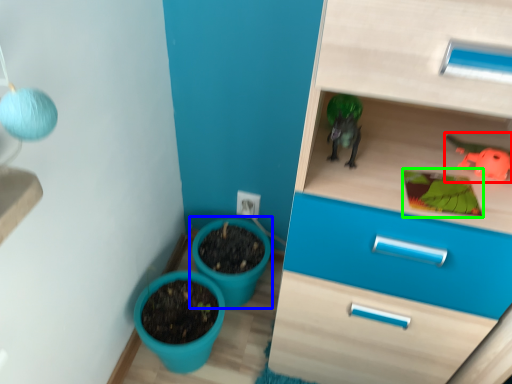
Question: Based on their relative distances, which object is farther from toy (highlighted by a red box)? Choose from flowerpot (highlighted by a blue box) and plant (highlighted by a green box).

Choices:
 (A) flowerpot
 (B) plant

Answer: (A)